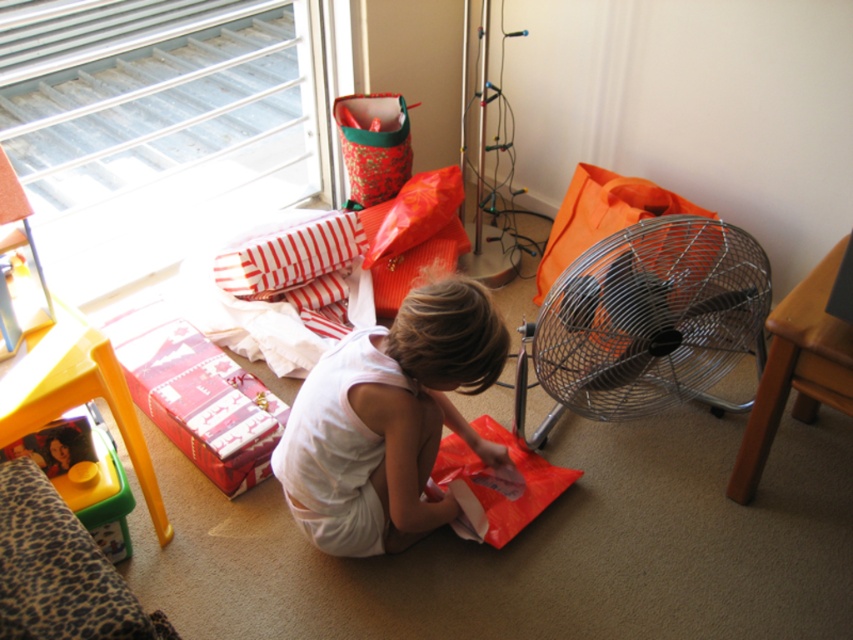
Question: Considering the real-world distances, which object is farthest from the red shiny wrapping paper at lower left?

Choices:
 (A) white fabric child at center
 (B) metallic silver fan at right

Answer: (B)

Question: In this image, where is metallic silver fan at right located relative to red shiny wrapping paper at lower left?

Choices:
 (A) left
 (B) right

Answer: (B)

Question: Which point appears farthest from the camera in this image?

Choices:
 (A) (541, 444)
 (B) (227, 467)

Answer: (A)

Question: Which of the following is the closest to the observer?

Choices:
 (A) (447, 292)
 (B) (553, 310)

Answer: (A)

Question: Can you confirm if metallic silver fan at right is positioned below red shiny wrapping paper at lower left?

Choices:
 (A) yes
 (B) no

Answer: (B)

Question: Is metallic silver fan at right further to camera compared to red shiny wrapping paper at lower left?

Choices:
 (A) yes
 (B) no

Answer: (B)